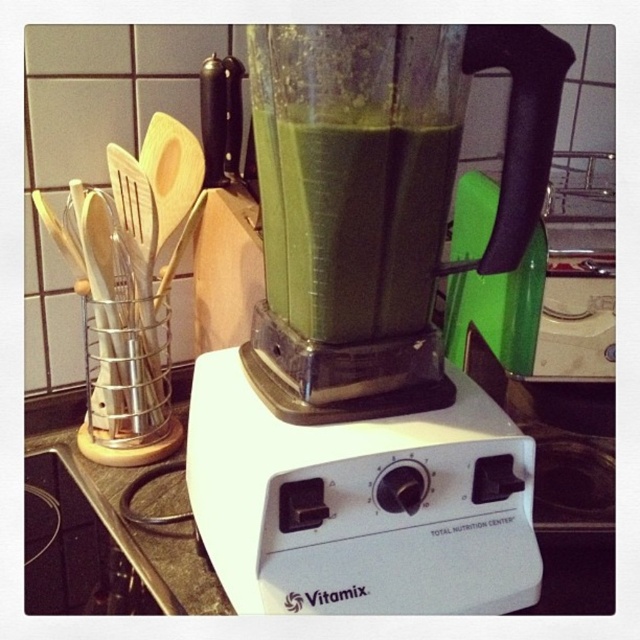
You are a chef preparing a recipe and need to place a measuring cup next to the green smoothie at center. According to the kitchen layout, where should you position the measuring cup relative to the blender?

The green smoothie at center is located at point (362, 225), so you should place the measuring cup near that coordinate to be next to it.

You are a delivery person who just delivered a new blender to a customer. The customer wants to place the translucent plastic blender at center on the white plastic countertop at center. Can you confirm if there is enough space between the two for the blender to fit?

The translucent plastic blender at center and white plastic countertop at center are 26.12 centimeters apart from each other. Since the distance between them is sufficient, the blender can be placed on the countertop.